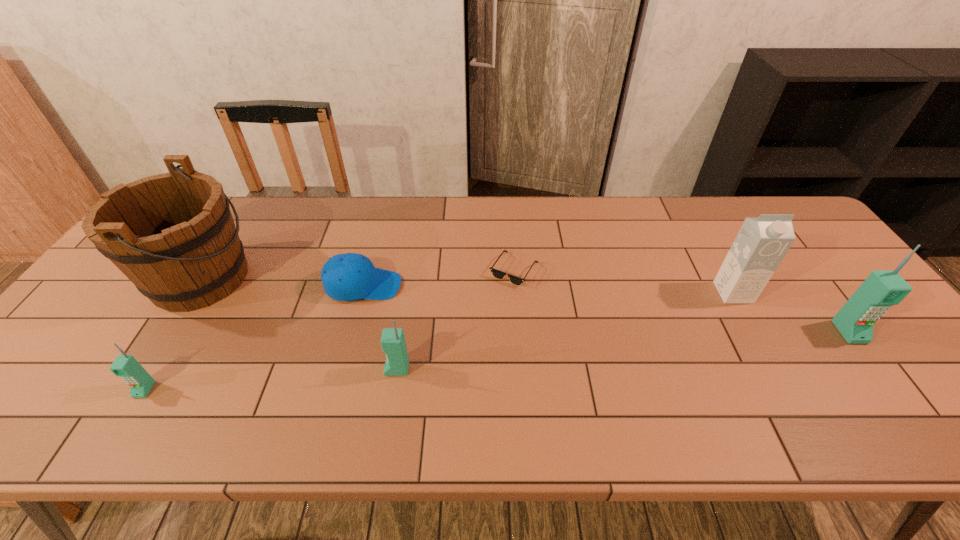
The width and height of the screenshot is (960, 540). I want to click on the sixth tallest object, so click(x=350, y=276).

Find the location of `vacant space situated 0.130m on the keypad of the second nearest cellular telephone`. vacant space situated 0.130m on the keypad of the second nearest cellular telephone is located at coordinates (328, 369).

Where is `free space located 0.060m on the keypad of the second nearest cellular telephone`? The width and height of the screenshot is (960, 540). free space located 0.060m on the keypad of the second nearest cellular telephone is located at coordinates (359, 369).

In order to click on blank space located 0.300m on the keypad of the second nearest cellular telephone in this screenshot , I will do `click(254, 369)`.

This screenshot has height=540, width=960. I want to click on vacant area situated on the keypad of the rightmost cellular telephone, so click(x=891, y=388).

Where is `free point located on the lenses of the third object from right to left`? This screenshot has height=540, width=960. free point located on the lenses of the third object from right to left is located at coordinates (522, 371).

Locate an element on the screen. free region located 0.090m on the front label of the carton is located at coordinates (755, 331).

Identify the location of free space located on the side of the wine bucket with the handle for carrying. The height and width of the screenshot is (540, 960). (351, 278).

Locate an element on the screen. The width and height of the screenshot is (960, 540). vacant space located 0.270m on the front-facing side of the cap is located at coordinates (500, 286).

The width and height of the screenshot is (960, 540). I want to click on object located in the far edge section of the desktop, so click(x=172, y=235).